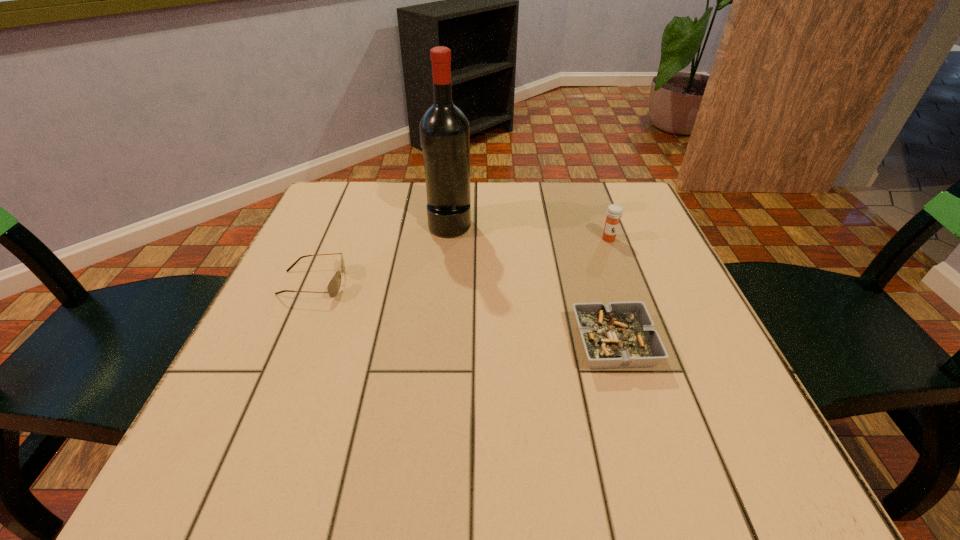
In the image, there is a desktop. Identify the location of vacant space at the far right corner. This screenshot has width=960, height=540. (601, 229).

Identify the location of vacant space at the near right corner. (774, 474).

Find the location of a particular element. The image size is (960, 540). vacant area that lies between the leftmost object and the second object from left to right is located at coordinates (381, 254).

Find the location of a particular element. This screenshot has height=540, width=960. unoccupied area between the second tallest object and the ashtray is located at coordinates (612, 292).

Image resolution: width=960 pixels, height=540 pixels. What are the coordinates of `unoccupied position between the third farthest object and the third shortest object` in the screenshot? It's located at (461, 261).

You are a GUI agent. You are given a task and a screenshot of the screen. Output one action in this format:
    pyautogui.click(x=<x>, y=<y>)
    Task: Click on the vacant region between the sunglasses and the medicine
    
    Given the screenshot: What is the action you would take?
    pyautogui.click(x=461, y=261)

I want to click on vacant space that's between the second nearest object and the tallest object, so click(x=381, y=254).

Find the location of a particular element. blank region between the ashtray and the wine bottle is located at coordinates (532, 284).

Where is `vacant space that's between the second nearest object and the nearest object`? vacant space that's between the second nearest object and the nearest object is located at coordinates (464, 313).

Identify the location of vacant area between the medicine and the leftmost object. Image resolution: width=960 pixels, height=540 pixels. (461, 261).